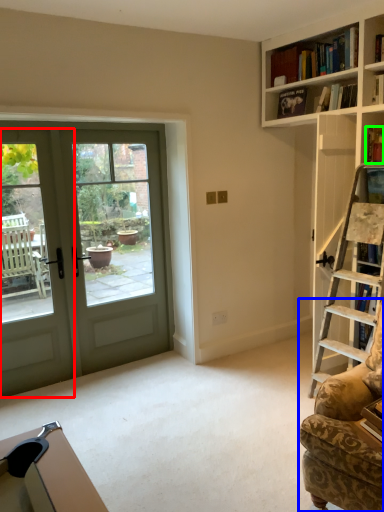
Question: Considering the real-world distances, which object is farthest from screen door (highlighted by a red box)? rocking chair (highlighted by a blue box) or book (highlighted by a green box)?

Choices:
 (A) rocking chair
 (B) book

Answer: (B)